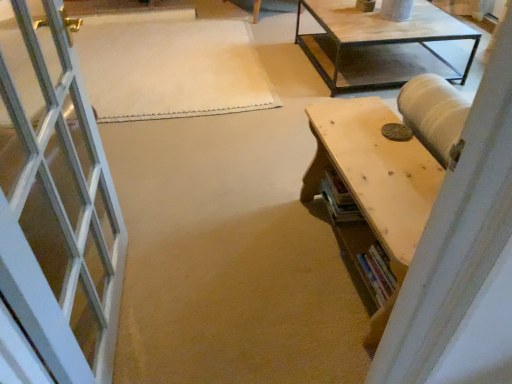
Question: Is wooden table at right wider or thinner than white woven mat at center?

Choices:
 (A) wide
 (B) thin

Answer: (B)

Question: Is point (370, 230) positioned closer to the camera than point (146, 24)?

Choices:
 (A) closer
 (B) farther

Answer: (A)

Question: Is wooden table at right in front of or behind white woven mat at center in the image?

Choices:
 (A) behind
 (B) front

Answer: (B)

Question: Would you say white woven mat at center is to the left or to the right of wooden table at right in the picture?

Choices:
 (A) right
 (B) left

Answer: (B)

Question: Considering the positions of white woven mat at center and wooden table at right in the image, is white woven mat at center wider or thinner than wooden table at right?

Choices:
 (A) thin
 (B) wide

Answer: (B)

Question: Considering the positions of point (187, 13) and point (361, 200), is point (187, 13) closer or farther from the camera than point (361, 200)?

Choices:
 (A) farther
 (B) closer

Answer: (A)

Question: From the image's perspective, is white woven mat at center positioned above or below wooden table at right?

Choices:
 (A) below
 (B) above

Answer: (B)